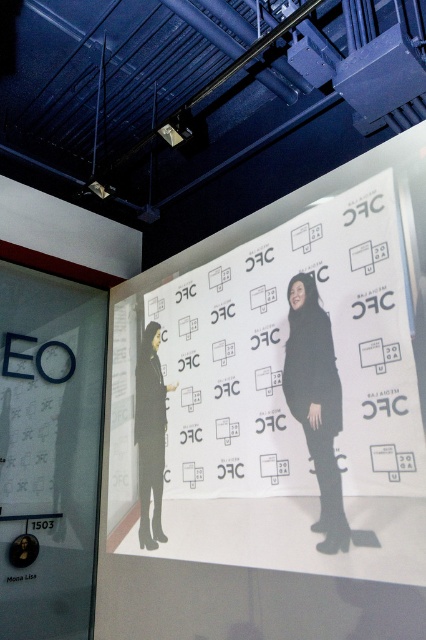
You are a fashion designer who needs to place a 1.5 meter wide mannequin between the black matte coat at center and the black matte coat at left. Can the mannequin fit between them without touching either coat?

The black matte coat at center and black matte coat at left are 1.44 meters apart from each other. Since the mannequin is 1.5 meters wide, it cannot fit between them without overlapping or touching the coats.